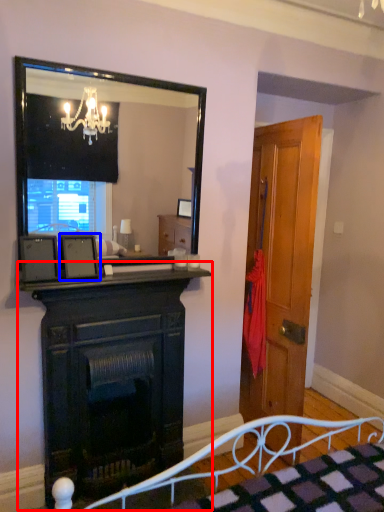
Question: Which object is further to the camera taking this photo, fireplace (highlighted by a red box) or picture frame (highlighted by a blue box)?

Choices:
 (A) fireplace
 (B) picture frame

Answer: (B)